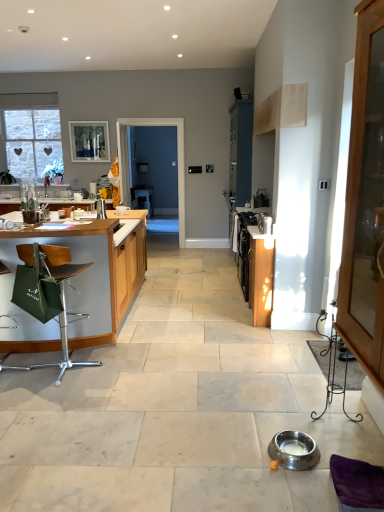
This screenshot has width=384, height=512. I want to click on unoccupied region to the right of green leather chair at left, so click(119, 369).